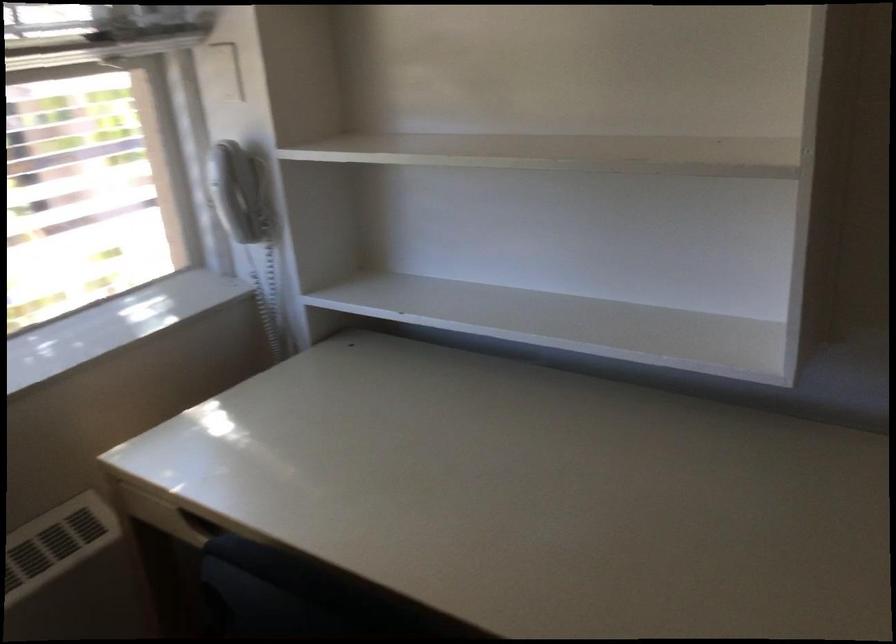
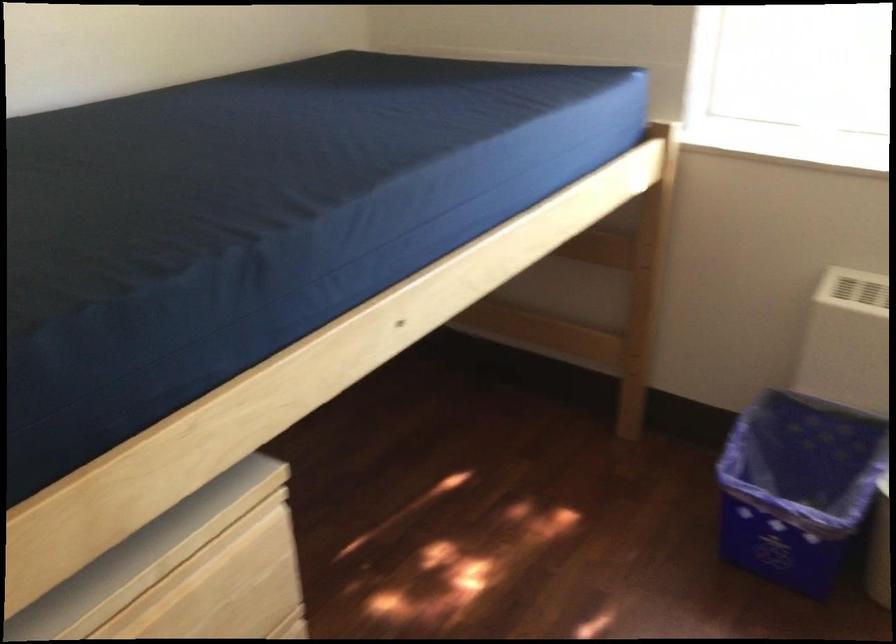
How did the camera likely rotate?

The camera rotated toward left-down.